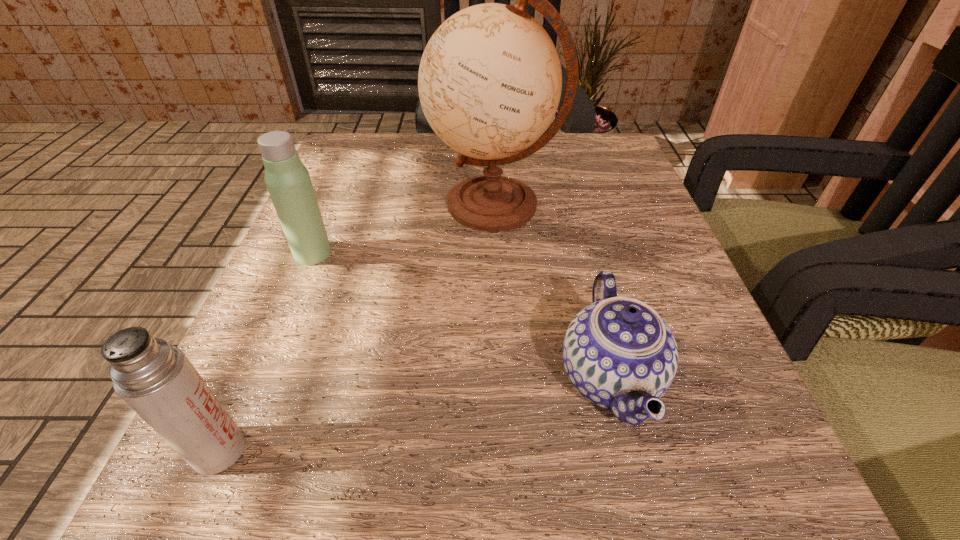
Identify the location of vacant region at the near edge. (439, 471).

Find the location of a particular element. vacant space at the left edge is located at coordinates (260, 322).

Where is `vacant area at the right edge`? vacant area at the right edge is located at coordinates (568, 208).

The image size is (960, 540). Identify the location of free space at the far left corner of the desktop. (337, 191).

You are a GUI agent. You are given a task and a screenshot of the screen. Output one action in this format:
    pyautogui.click(x=<x>, y=<y>)
    Task: Click on the blank space at the far right corner
    The width and height of the screenshot is (960, 540).
    Given the screenshot: What is the action you would take?
    pyautogui.click(x=590, y=133)

The height and width of the screenshot is (540, 960). Identify the location of vacant region at the near right corner of the desktop. (706, 487).

Find the location of a particular element. This screenshot has height=540, width=960. free space between the tallest object and the nearer thermos bottle is located at coordinates (357, 327).

Identify the location of free spot between the nearer thermos bottle and the farther thermos bottle. Image resolution: width=960 pixels, height=540 pixels. (266, 352).

In order to click on vacant area that lies between the globe and the nearer thermos bottle in this screenshot , I will do (357, 327).

Image resolution: width=960 pixels, height=540 pixels. I want to click on empty location between the tallest object and the farther thermos bottle, so click(x=404, y=229).